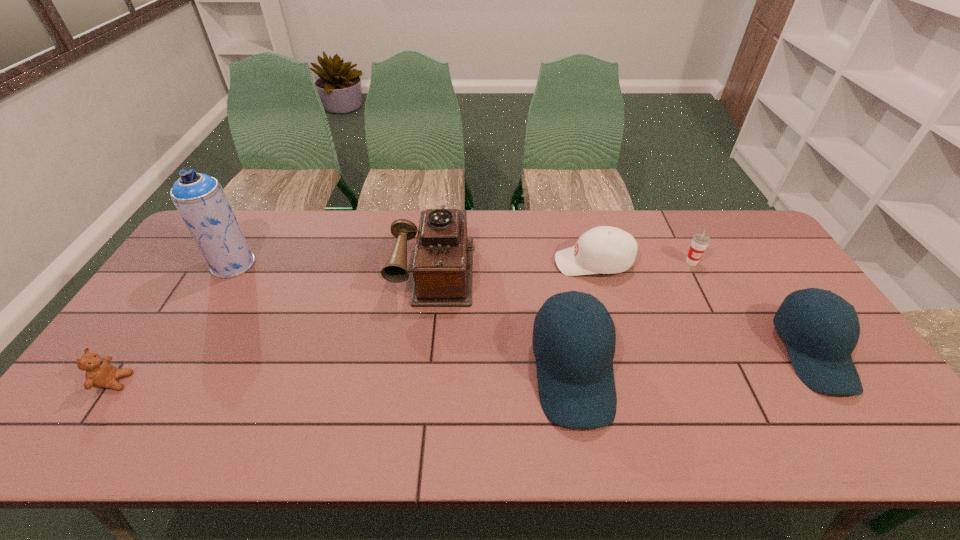
The width and height of the screenshot is (960, 540). I want to click on the fifth closest object to the second shortest baseball cap, so click(x=199, y=198).

Choose which baseball cap is the third nearest neighbor to the cup. Please provide its 2D coordinates. Your answer should be formatted as a tuple, i.e. [(x, y)], where the tuple contains the x and y coordinates of a point satisfying the conditions above.

[(576, 386)]

Locate an element on the screen. The width and height of the screenshot is (960, 540). baseball cap that stands as the third closest to the leftmost object is located at coordinates (820, 351).

This screenshot has width=960, height=540. In order to click on free space that satisfies the following two spatial constraints: 1. on the front-facing side of the farthest baseball cap; 2. on the front-facing side of the tallest baseball cap in this screenshot , I will do `click(623, 372)`.

The image size is (960, 540). I want to click on free space that satisfies the following two spatial constraints: 1. on the front-facing side of the shortest baseball cap; 2. on the front-facing side of the tallest baseball cap, so click(623, 372).

Where is `free space that satisfies the following two spatial constraints: 1. on the side of the sixth object from left to right with the logo; 2. on the front-facing side of the shortest baseball cap`? The height and width of the screenshot is (540, 960). free space that satisfies the following two spatial constraints: 1. on the side of the sixth object from left to right with the logo; 2. on the front-facing side of the shortest baseball cap is located at coordinates (692, 262).